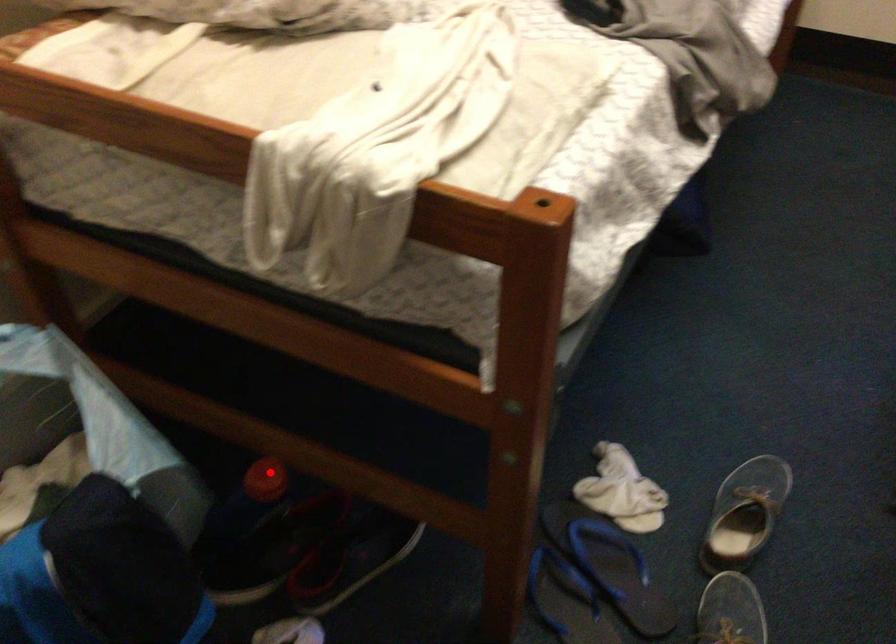
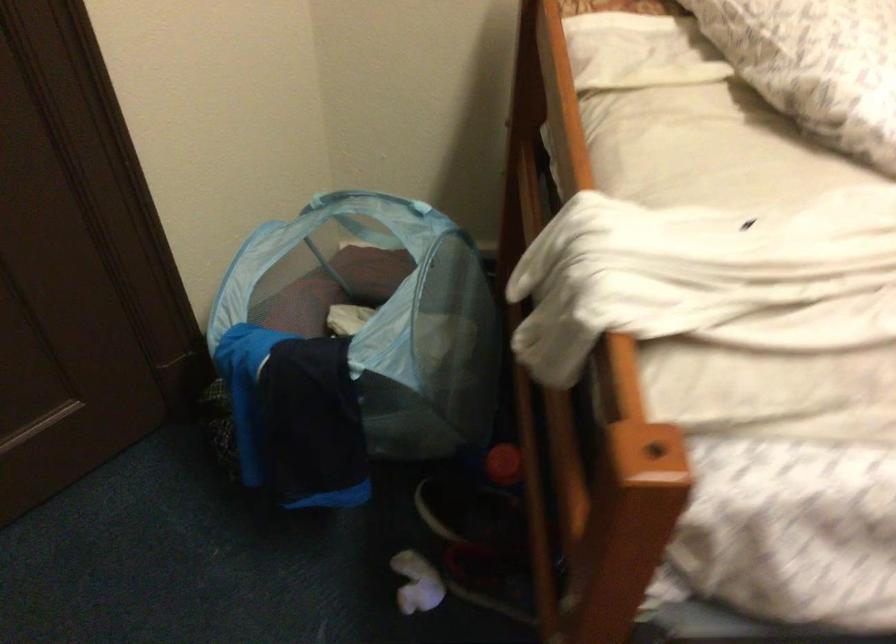
Find the pixel in the second image that matches the highlighted location in the first image.

(504, 464)